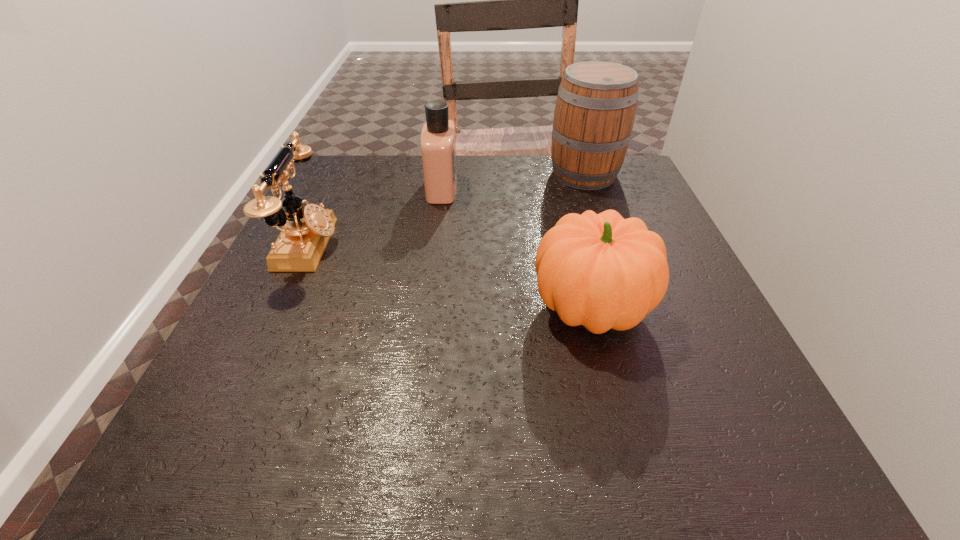
Locate an element on the screen. Image resolution: width=960 pixels, height=540 pixels. cider is located at coordinates (595, 110).

Find the location of a particular element. the third object from right to left is located at coordinates 438,140.

You are a GUI agent. You are given a task and a screenshot of the screen. Output one action in this format:
    pyautogui.click(x=<x>, y=<y>)
    Task: Click on the leftmost object
    Image resolution: width=960 pixels, height=540 pixels.
    Given the screenshot: What is the action you would take?
    pyautogui.click(x=305, y=232)

What are the coordinates of `pumpkin` in the screenshot? It's located at (602, 271).

Where is `free space located on the front of the tallest object`? This screenshot has width=960, height=540. free space located on the front of the tallest object is located at coordinates (610, 247).

Locate an element on the screen. This screenshot has width=960, height=540. vacant position located 0.140m on the front label of the perfume is located at coordinates (515, 188).

You are a GUI agent. You are given a task and a screenshot of the screen. Output one action in this format:
    pyautogui.click(x=<x>, y=<y>)
    Task: Click on the blank area located on the dial of the leftmost object
    
    Given the screenshot: What is the action you would take?
    pyautogui.click(x=530, y=245)

The image size is (960, 540). Identify the location of vacant area located on the left of the pumpkin. (385, 308).

Where is `cider that is at the far edge`? Image resolution: width=960 pixels, height=540 pixels. cider that is at the far edge is located at coordinates (595, 110).

Locate an element on the screen. The width and height of the screenshot is (960, 540). perfume that is positioned at the far edge is located at coordinates (438, 140).